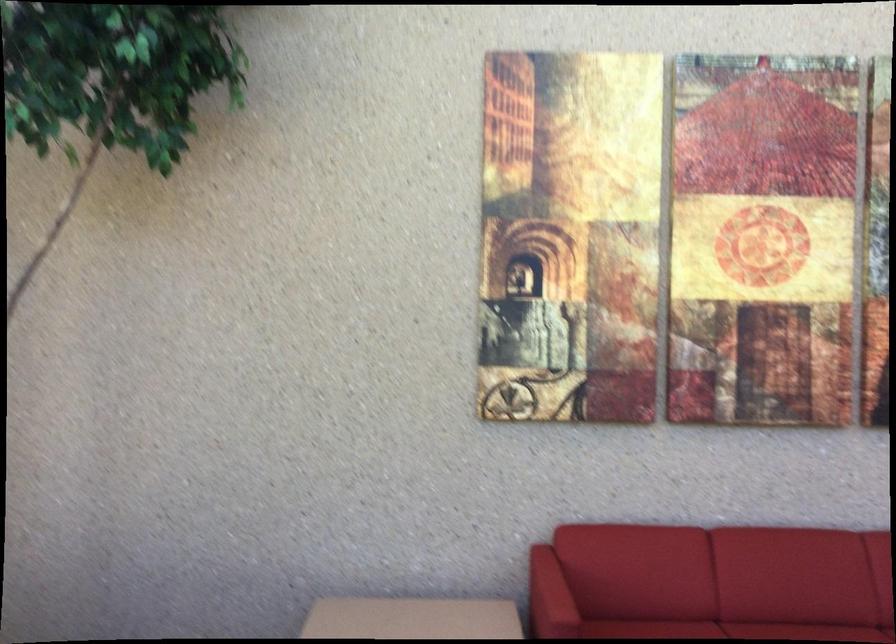
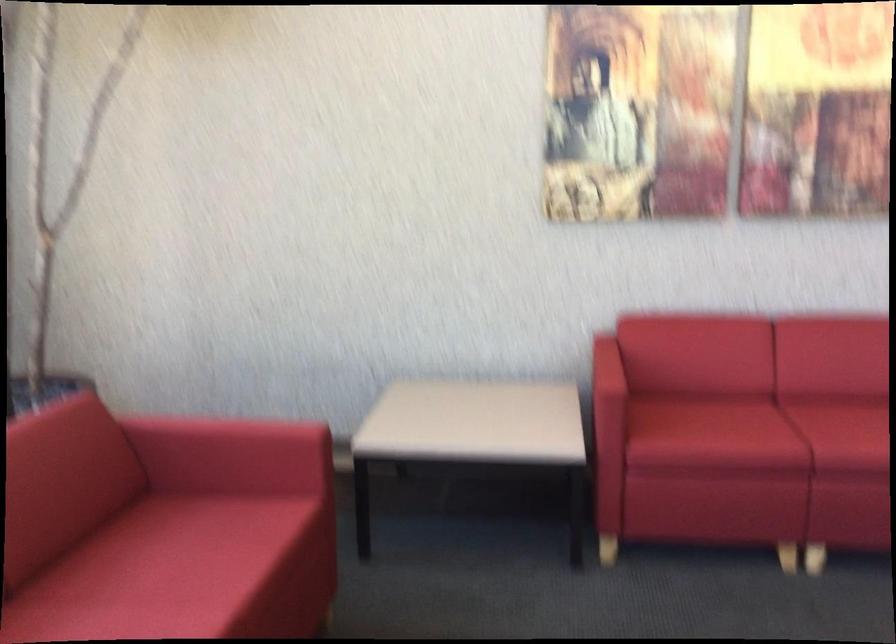
Question: Based on the continuous images, in which direction is the camera rotating? Reply with the corresponding letter.

Choices:
 (A) Left
 (B) Right
 (C) Up
 (D) Down

Answer: (D)